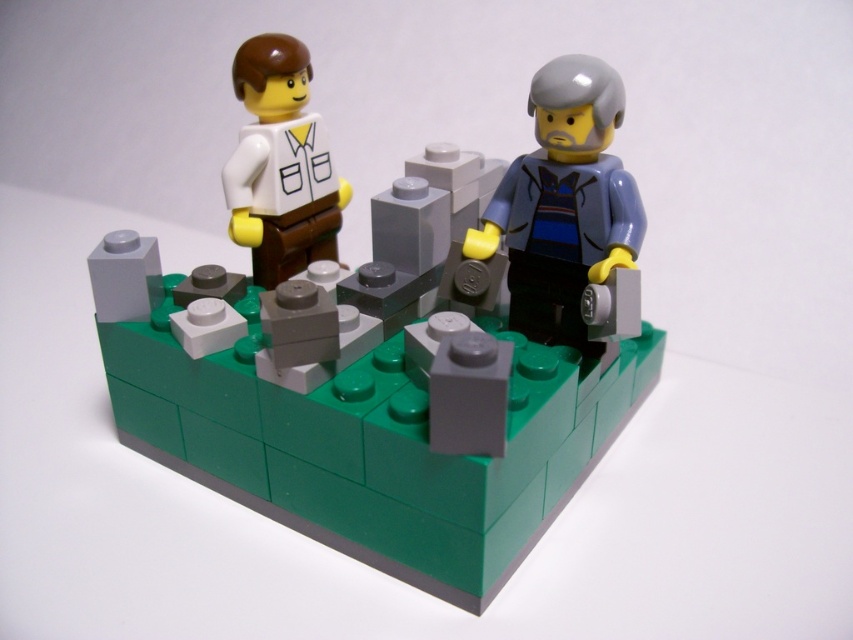
From the picture: You are a small toy car that is 10 centimeters long. You are placed on the LEGO base and want to drive from the matte gray minifigure at center right to the matte white shirt at upper left. Can you make the trip without any obstacles?

The distance between the matte gray minifigure at center right and the matte white shirt at upper left is 30.21 centimeters. Since the toy car is only 10 centimeters long, it can easily travel the distance between them without any issues.